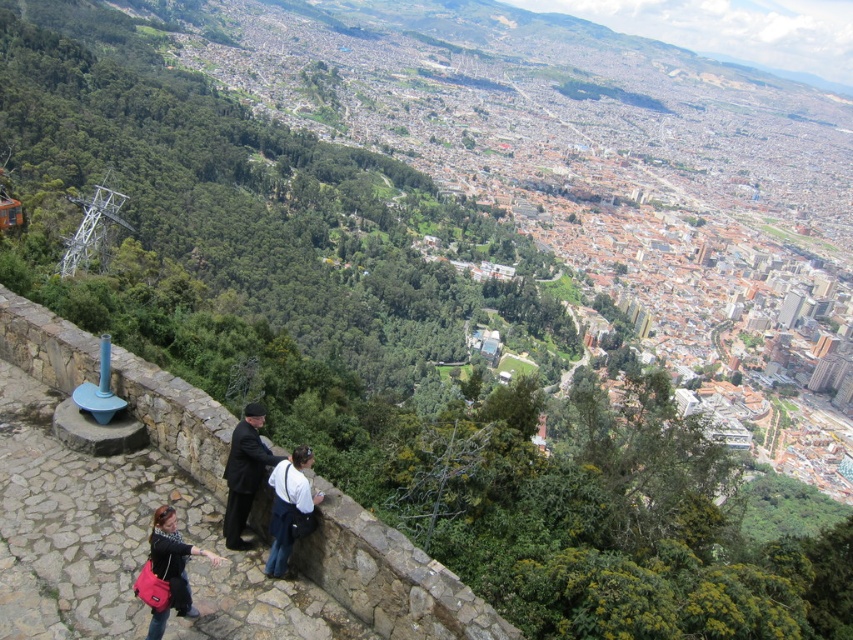
Question: Which object appears closest to the camera in this image?

Choices:
 (A) dark suit at center
 (B) matte black jacket at lower left

Answer: (B)

Question: Among these points, which one is farthest from the camera?

Choices:
 (A) (126, 400)
 (B) (314, 502)
 (C) (187, 600)

Answer: (A)

Question: Among these objects, which one is farthest from the camera?

Choices:
 (A) matte black jacket at lower left
 (B) dark suit at center
 (C) stone at lower left
 (D) white shirt at center

Answer: (B)

Question: Can you confirm if dark suit at center is positioned above white shirt at center?

Choices:
 (A) yes
 (B) no

Answer: (A)

Question: Can you confirm if stone at lower left is positioned to the right of white shirt at center?

Choices:
 (A) yes
 (B) no

Answer: (B)

Question: Can you confirm if stone at lower left is thinner than white shirt at center?

Choices:
 (A) no
 (B) yes

Answer: (A)